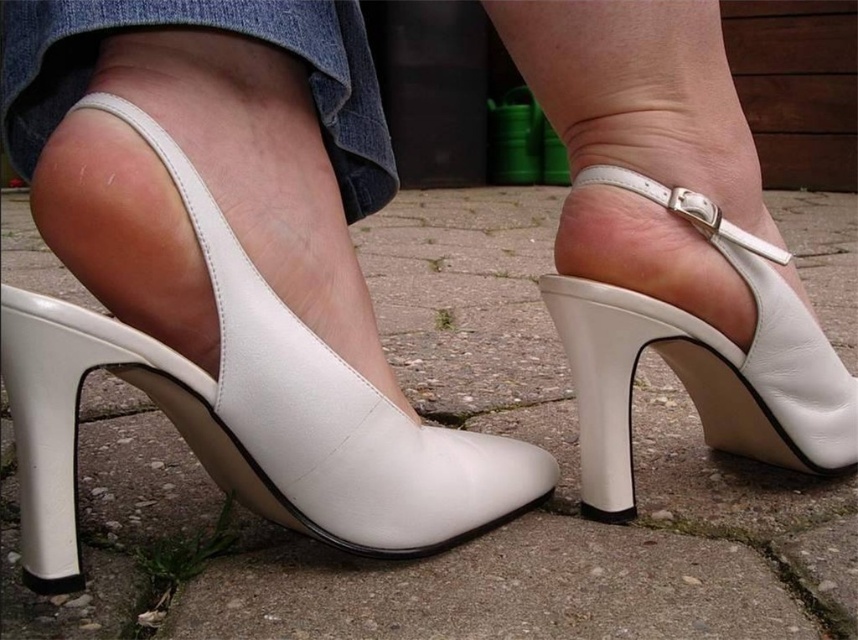
Question: In this image, where is white leather shoe at lower left located relative to white leather high-heeled shoe at center?

Choices:
 (A) above
 (B) below

Answer: (B)

Question: Which point is farther to the camera?

Choices:
 (A) white leather shoe at lower left
 (B) white leather high-heeled shoe at center

Answer: (B)

Question: Considering the relative positions of white leather shoe at lower left and white leather high-heeled shoe at center in the image provided, where is white leather shoe at lower left located with respect to white leather high-heeled shoe at center?

Choices:
 (A) left
 (B) right

Answer: (A)

Question: Can you confirm if white leather shoe at lower left is bigger than white leather high-heeled shoe at center?

Choices:
 (A) no
 (B) yes

Answer: (B)